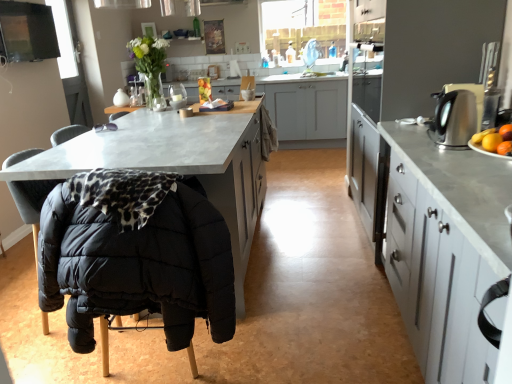
Question: Is black quilted fabric folding chair at lower left to the left of metallic gray cabinets at right, which is counted as the 1th cabinetry, starting from the front, from the viewer's perspective?

Choices:
 (A) yes
 (B) no

Answer: (A)

Question: Is black quilted fabric folding chair at lower left positioned beyond the bounds of metallic gray cabinets at right, which is counted as the 1th cabinetry, starting from the front?

Choices:
 (A) yes
 (B) no

Answer: (A)

Question: Does black quilted fabric folding chair at lower left have a larger size compared to metallic gray cabinets at right, which ranks as the third cabinetry in back-to-front order?

Choices:
 (A) no
 (B) yes

Answer: (A)

Question: Is black quilted fabric folding chair at lower left positioned behind metallic gray cabinets at right, which is counted as the 1th cabinetry, starting from the front?

Choices:
 (A) no
 (B) yes

Answer: (B)

Question: Is black quilted fabric folding chair at lower left positioned before metallic gray cabinets at right, which ranks as the third cabinetry in back-to-front order?

Choices:
 (A) yes
 (B) no

Answer: (B)

Question: Choose the correct answer: Is concrete countertop at center, the 3th cabinetry when ordered from front to back, inside matte gray cabinet at center, arranged as the second cabinetry when viewed from the front, or outside it?

Choices:
 (A) inside
 (B) outside

Answer: (B)

Question: In the image, is concrete countertop at center, marked as the first cabinetry in a back-to-front arrangement, on the left side or the right side of matte gray cabinet at center, the second cabinetry in the back-to-front sequence?

Choices:
 (A) right
 (B) left

Answer: (A)

Question: In the image, is concrete countertop at center, marked as the first cabinetry in a back-to-front arrangement, positioned in front of or behind matte gray cabinet at center, arranged as the second cabinetry when viewed from the front?

Choices:
 (A) behind
 (B) front

Answer: (A)

Question: In terms of width, does concrete countertop at center, the 3th cabinetry when ordered from front to back, look wider or thinner when compared to matte gray cabinet at center, arranged as the second cabinetry when viewed from the front?

Choices:
 (A) thin
 (B) wide

Answer: (A)

Question: Considering their positions, is metallic gray cabinets at right, which is counted as the 1th cabinetry, starting from the front, located in front of or behind matte gray cabinet at center, the second cabinetry in the back-to-front sequence?

Choices:
 (A) front
 (B) behind

Answer: (A)

Question: Looking at the image, does metallic gray cabinets at right, which ranks as the third cabinetry in back-to-front order, seem bigger or smaller compared to matte gray cabinet at center, the second cabinetry in the back-to-front sequence?

Choices:
 (A) small
 (B) big

Answer: (A)

Question: From a real-world perspective, is metallic gray cabinets at right, which ranks as the third cabinetry in back-to-front order, positioned above or below matte gray cabinet at center, arranged as the second cabinetry when viewed from the front?

Choices:
 (A) above
 (B) below

Answer: (B)

Question: Is metallic gray cabinets at right, which ranks as the third cabinetry in back-to-front order, taller or shorter than matte gray cabinet at center, the second cabinetry in the back-to-front sequence?

Choices:
 (A) tall
 (B) short

Answer: (B)

Question: In terms of size, does metallic gray cabinets at right, which ranks as the third cabinetry in back-to-front order, appear bigger or smaller than concrete countertop at center, the 3th cabinetry when ordered from front to back?

Choices:
 (A) small
 (B) big

Answer: (A)

Question: Which is correct: metallic gray cabinets at right, which ranks as the third cabinetry in back-to-front order, is inside concrete countertop at center, the 3th cabinetry when ordered from front to back, or outside of it?

Choices:
 (A) inside
 (B) outside

Answer: (B)